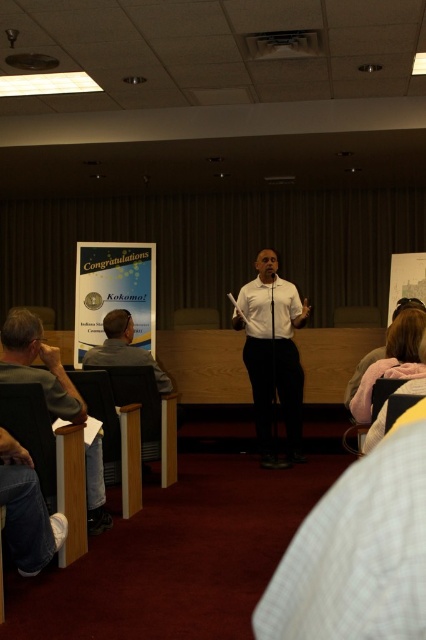
Based on the scene description, where is the white smooth shirt at center located in terms of its 2D coordinates?

The white smooth shirt at center is located at the 2D coordinates of point (273,353).

You are an event planner who needs to ensure all speakers have the right attire. You see the white smooth shirt at center and the matte gray shirt at lower left. Which shirt is bigger in size?

The white smooth shirt at center is larger in size compared to the matte gray shirt at lower left.